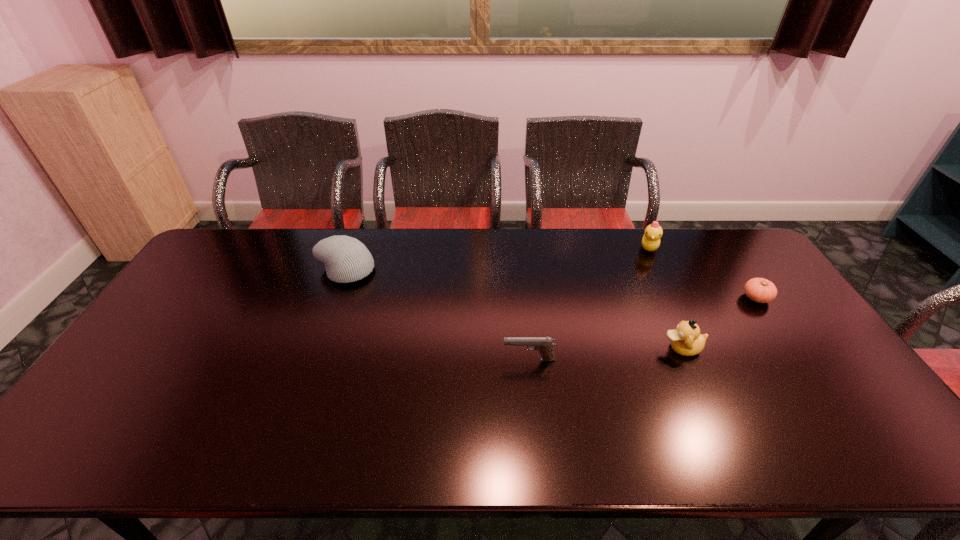
Locate an element on the screen. free space between the rightmost object and the leftmost object is located at coordinates (551, 284).

Find the location of a particular element. This screenshot has height=540, width=960. vacant point located between the farther duckling and the nearer duckling is located at coordinates (665, 298).

What are the coordinates of `free point between the pistol and the beanie` in the screenshot? It's located at (437, 315).

The image size is (960, 540). What are the coordinates of `vacant space in between the farther duckling and the nearer duckling` in the screenshot? It's located at (665, 298).

This screenshot has height=540, width=960. In order to click on empty space that is in between the nearer duckling and the farther duckling in this screenshot , I will do `click(665, 298)`.

The width and height of the screenshot is (960, 540). I want to click on object that ranks as the fourth closest to the shortest object, so click(x=346, y=259).

Choose which object is the fourth nearest neighbor to the beanie. Please provide its 2D coordinates. Your answer should be formatted as a tuple, i.e. [(x, y)], where the tuple contains the x and y coordinates of a point satisfying the conditions above.

[(760, 290)]

This screenshot has height=540, width=960. What are the coordinates of `free space that satisfies the following two spatial constraints: 1. on the front-facing side of the farther duckling; 2. on the face of the nearer duckling` in the screenshot? It's located at (696, 348).

Find the location of a particular element. The width and height of the screenshot is (960, 540). vacant space that satisfies the following two spatial constraints: 1. on the front-facing side of the farther duckling; 2. at the barrel of the pistol is located at coordinates (702, 360).